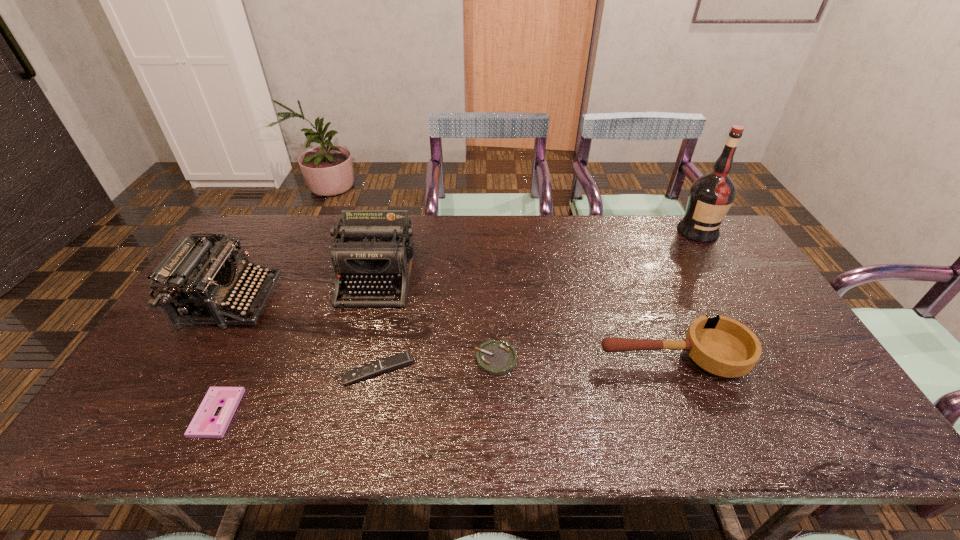
You are a GUI agent. You are given a task and a screenshot of the screen. Output one action in this format:
    pyautogui.click(x=<x>, y=<y>)
    Task: Click on the typewriter at the far edge
    The width and height of the screenshot is (960, 540).
    Given the screenshot: What is the action you would take?
    pyautogui.click(x=376, y=247)

I want to click on object located at the near edge, so click(201, 426).

Identify the location of object present at the left edge. (197, 282).

What are the coordinates of `object positioned at the right edge` in the screenshot? It's located at (711, 195).

Identify the location of object located in the far right corner section of the desktop. This screenshot has height=540, width=960. (711, 195).

This screenshot has height=540, width=960. In the image, there is a desktop. Find the location of `vacant region at the far edge`. vacant region at the far edge is located at coordinates (578, 218).

In order to click on free space at the near edge in this screenshot , I will do `click(459, 448)`.

Find the location of a particular element. vacant space at the left edge of the desktop is located at coordinates tap(200, 348).

Where is `free space at the right edge of the desktop`? free space at the right edge of the desktop is located at coordinates (742, 273).

Identify the location of vacant space at the far right corner of the desktop. The width and height of the screenshot is (960, 540). (697, 249).